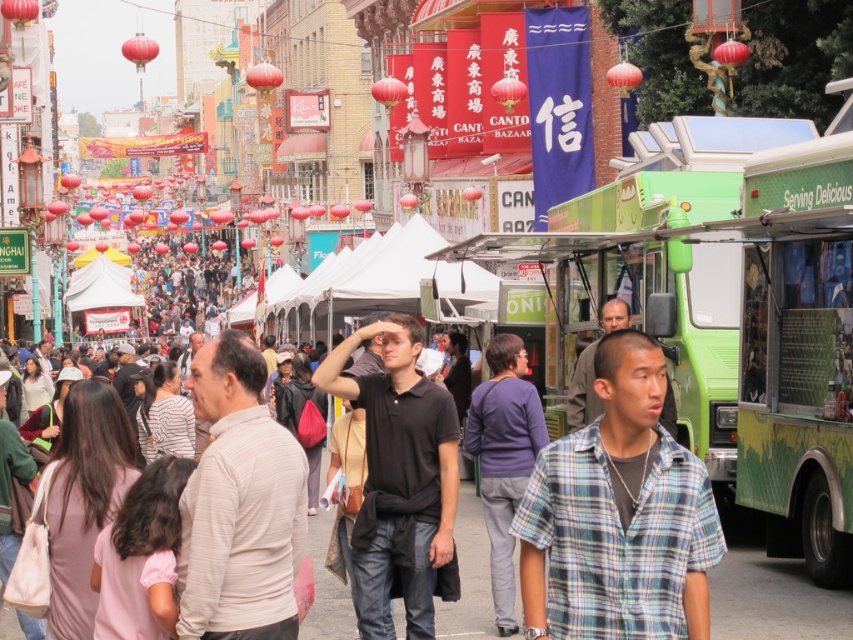
You are a photographer standing at the corner of the street. You want to take a photo of the light beige striped shirt at center. Where should you position yourself to capture the best shot?

The light beige striped shirt at center is located at coordinates point (239, 504), so positioning yourself at the corner of the street facing towards that coordinate point would allow you to capture the best shot.

You are a photographer standing on the street and want to take a photo of the light beige striped shirt at center without the crowd at center blocking it. What should you do?

The light beige striped shirt at center is below the crowd at center, so you can lower your camera angle to capture the light beige striped shirt at center while avoiding the crowd at center.